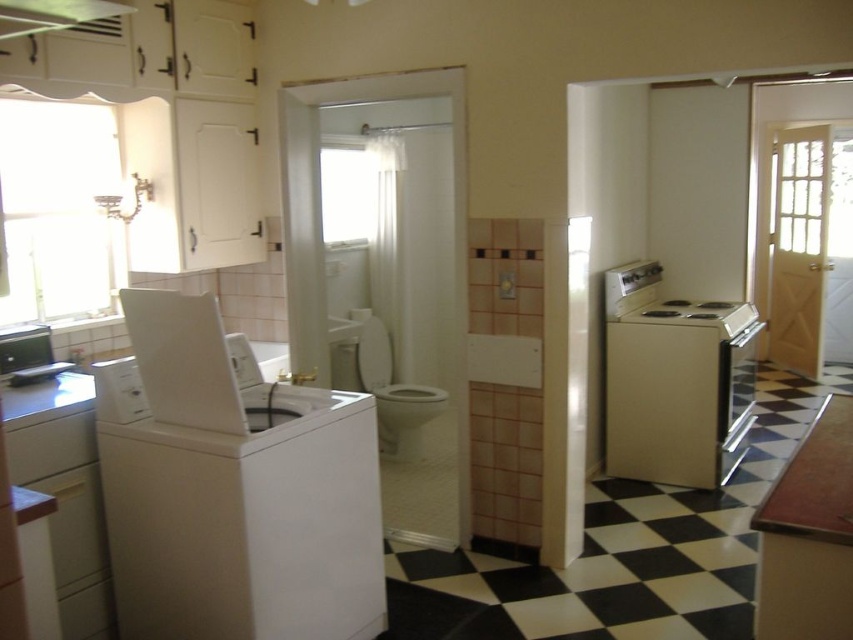
Does white matte washing machine at left appear over white glossy toilet bowl at center?

No.

Is point (277, 458) closer to camera compared to point (389, 420)?

Yes, point (277, 458) is in front of point (389, 420).

In order to click on white matte washing machine at left in this screenshot , I will do `click(231, 486)`.

Can you confirm if white matte washing machine at left is positioned to the left of white matte washing machine at center?

Indeed, white matte washing machine at left is positioned on the left side of white matte washing machine at center.

Image resolution: width=853 pixels, height=640 pixels. I want to click on white matte washing machine at left, so click(x=231, y=486).

Is white matte washing machine at center bigger than white glossy toilet bowl at center?

Yes.

Between point (672, 465) and point (381, 364), which one is positioned in front?

Positioned in front is point (672, 465).

Locate an element on the screen. The height and width of the screenshot is (640, 853). white matte washing machine at center is located at coordinates (675, 381).